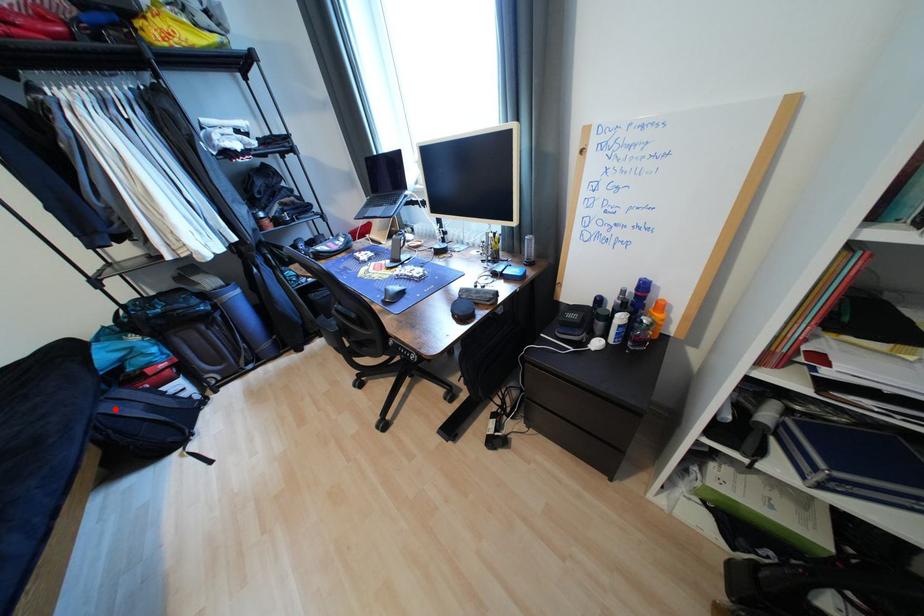
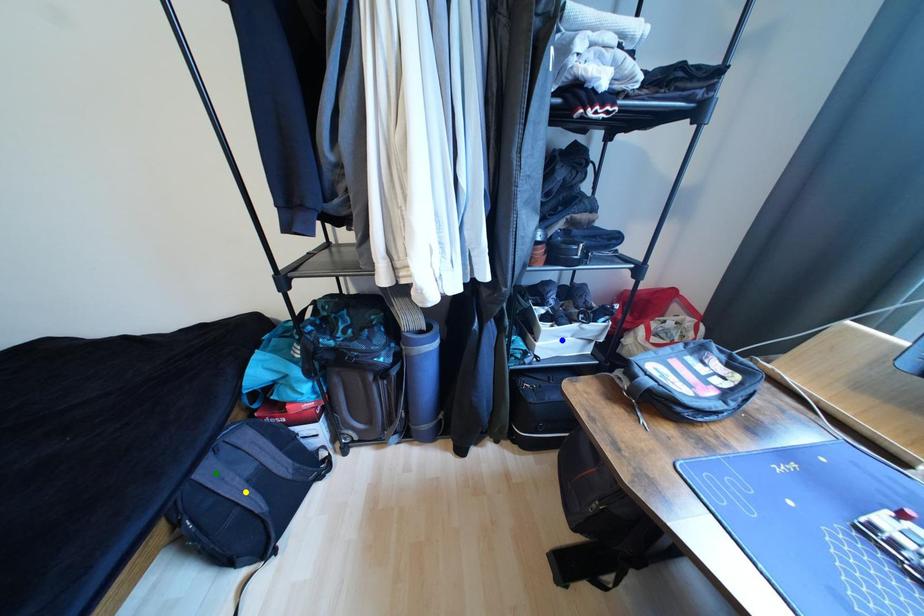
Question: I am providing you with two images of the same scene from different viewpoints. A red point is marked on the first image. You are given multiple points on the second image. Which point in image 2 is actually the same real-world point as the red point in image 1?

Choices:
 (A) yellow point
 (B) blue point
 (C) green point

Answer: (C)